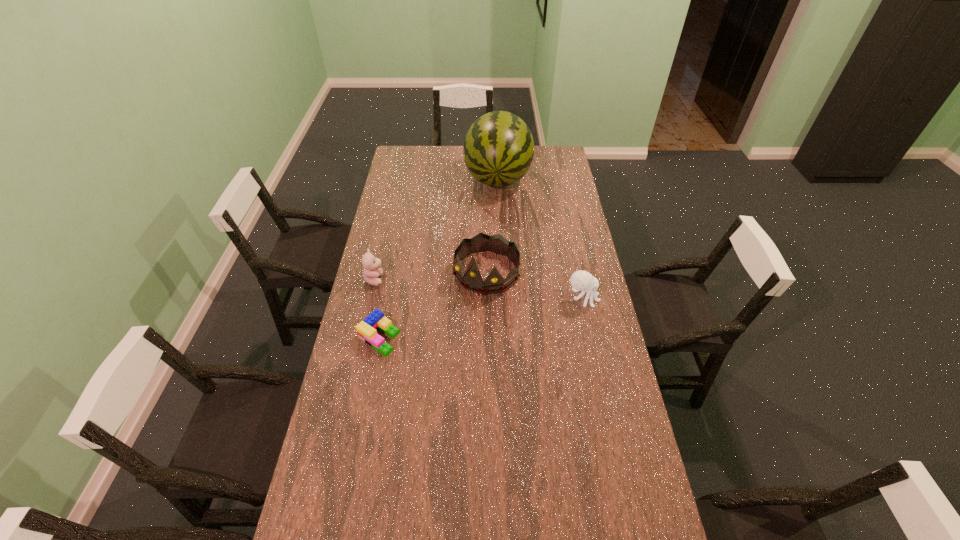
The width and height of the screenshot is (960, 540). Find the location of `free space between the watermelon and the shortest object`. free space between the watermelon and the shortest object is located at coordinates (439, 258).

I want to click on vacant area between the teddy bear and the fourth shortest object, so click(x=431, y=276).

The width and height of the screenshot is (960, 540). Identify the location of free space that is in between the nearest object and the watermelon. (439, 258).

Locate which object ranks second in proximity to the Lego. Please provide its 2D coordinates. Your answer should be formatted as a tuple, i.e. [(x, y)], where the tuple contains the x and y coordinates of a point satisfying the conditions above.

[(472, 280)]

Image resolution: width=960 pixels, height=540 pixels. In order to click on object that stands as the closest to the rightmost object in this screenshot , I will do `click(472, 280)`.